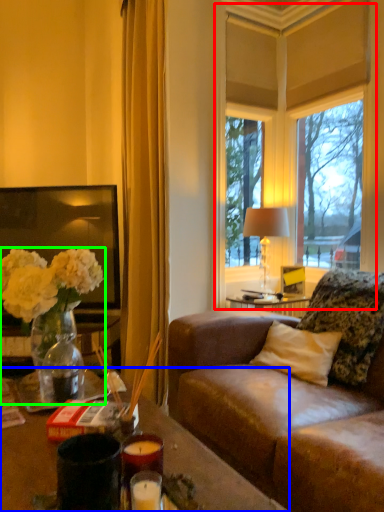
Question: Which object is the closest to the window (highlighted by a red box)? Choose among these: desk (highlighted by a blue box) or houseplant (highlighted by a green box).

Choices:
 (A) desk
 (B) houseplant

Answer: (B)